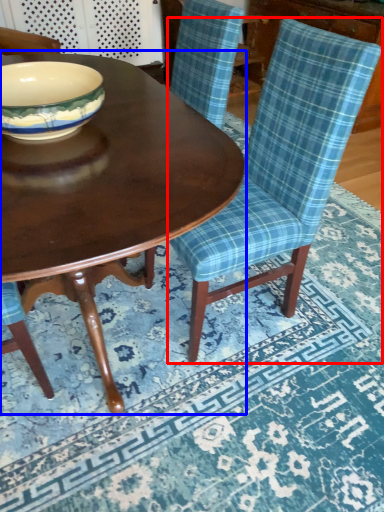
Question: Which point is further to the camera, chair (highlighted by a red box) or coffee table (highlighted by a blue box)?

Choices:
 (A) chair
 (B) coffee table

Answer: (A)